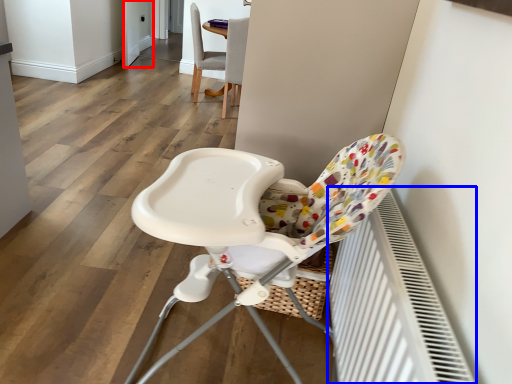
Question: Which of the following is the closest to the observer, screen door (highlighted by a red box) or radiator (highlighted by a blue box)?

Choices:
 (A) screen door
 (B) radiator

Answer: (B)